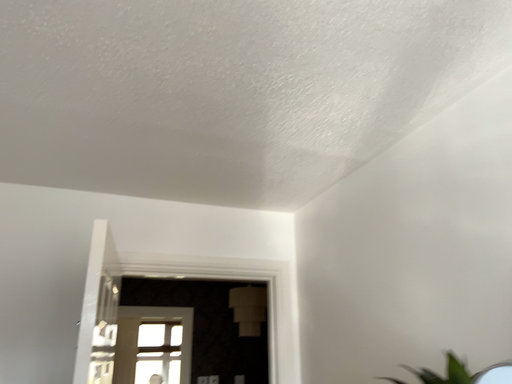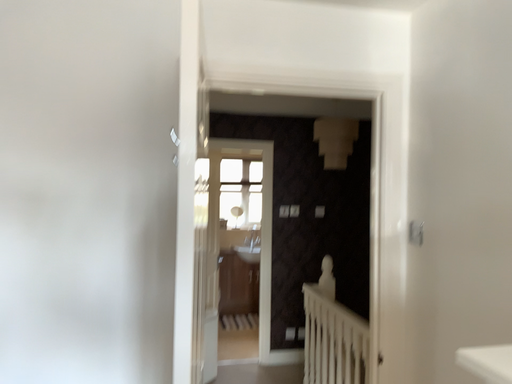
Question: Which way did the camera rotate in the video?

Choices:
 (A) rotated upward
 (B) rotated downward

Answer: (B)